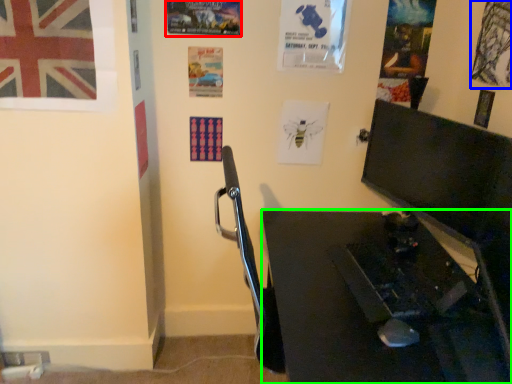
Question: Which object is positioned farthest from poster page (highlighted by a red box)? Select from poster page (highlighted by a blue box) and desk (highlighted by a green box).

Choices:
 (A) poster page
 (B) desk

Answer: (B)